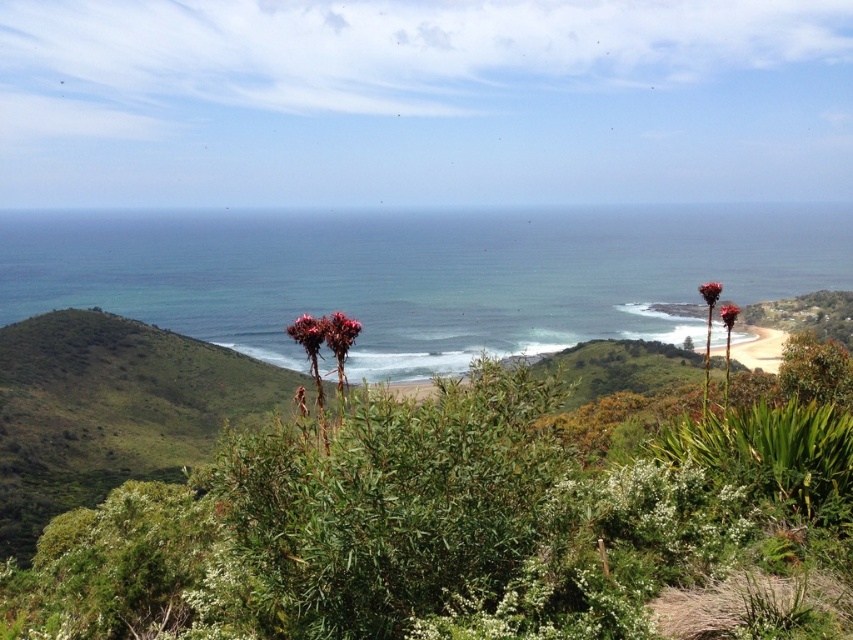
Please look at the image and locate the point with coordinates (421, 275). What color and type of object is located at that point?

The point at coordinates (421, 275) corresponds to the blue_green water at center.

You are a landscape photographer planning to capture the coastal landscape described. You want to position your tripod so that the green leafy shrubs at center are centered in your shot. Given the coordinate system where the bottom left corner of the image is at point 0,0 and the top right corner is at 1,1, what are the coordinates where you should place the tripod to center the shrubs?

The coordinates to center the green leafy shrubs at center are (x=461, y=525).